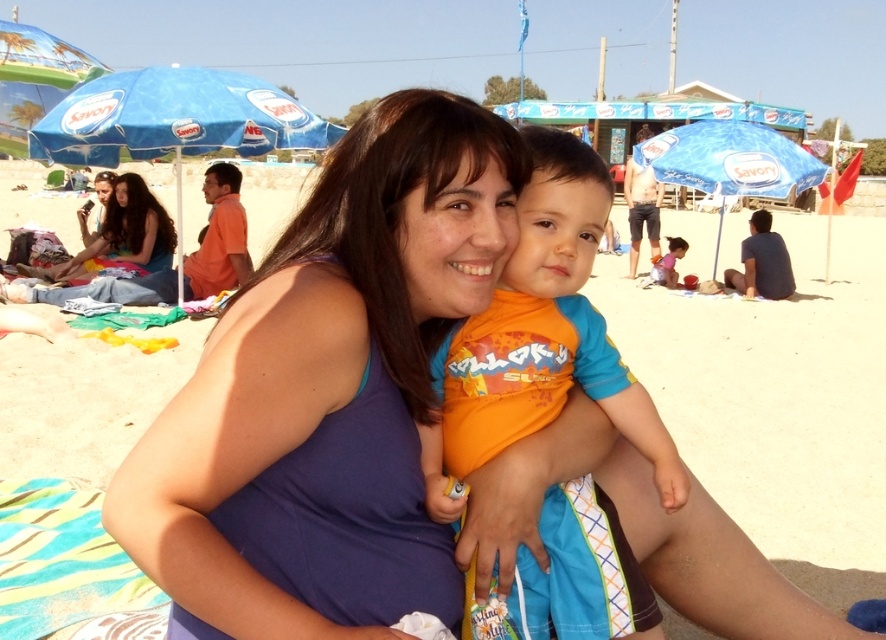
Is long brown hair at lower left bigger than orange cotton shirt at lower center?

Yes.

Is long brown hair at lower left closer to camera compared to orange cotton shirt at lower center?

Yes, it is.

Does point (113, 205) come in front of point (653, 260)?

That is True.

You are a GUI agent. You are given a task and a screenshot of the screen. Output one action in this format:
    pyautogui.click(x=<x>, y=<y>)
    Task: Click on the long brown hair at lower left
    The width and height of the screenshot is (886, 640).
    Given the screenshot: What is the action you would take?
    pyautogui.click(x=126, y=234)

Who is lower down, orange fabric shirt at center or blue fabric umbrella at center?

Positioned lower is orange fabric shirt at center.

Between point (662, 476) and point (689, 128), which one is positioned in front?

Positioned in front is point (662, 476).

Where is `orange fabric shirt at center`? Image resolution: width=886 pixels, height=640 pixels. orange fabric shirt at center is located at coordinates (546, 330).

Does blue fabric umbrella at upper left appear under long brown hair at lower left?

Actually, blue fabric umbrella at upper left is above long brown hair at lower left.

This screenshot has height=640, width=886. What do you see at coordinates (175, 118) in the screenshot?
I see `blue fabric umbrella at upper left` at bounding box center [175, 118].

This screenshot has width=886, height=640. Find the location of `blue fabric umbrella at upper left`. blue fabric umbrella at upper left is located at coordinates (175, 118).